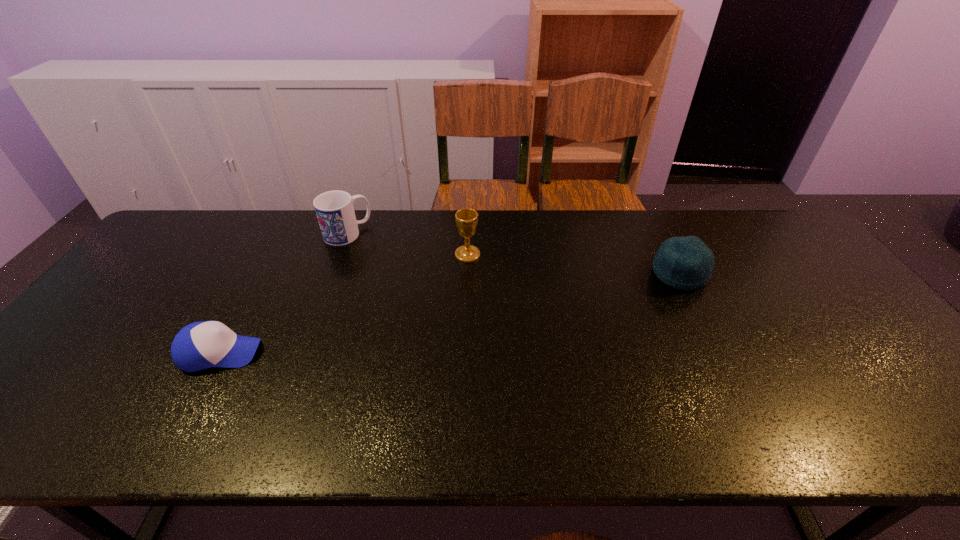
Locate an element on the screen. The height and width of the screenshot is (540, 960). free space between the farthest object and the nearest object is located at coordinates (284, 293).

The width and height of the screenshot is (960, 540). I want to click on vacant area that lies between the chalice and the shortest object, so click(x=344, y=304).

This screenshot has height=540, width=960. In order to click on empty space between the mug and the baseball cap in this screenshot , I will do `click(284, 293)`.

At what (x,y) coordinates should I click in order to perform the action: click on vacant space that's between the rightmost object and the shortest object. Please return your answer as a coordinate pair (x, y). Image resolution: width=960 pixels, height=540 pixels. Looking at the image, I should click on (450, 313).

You are a GUI agent. You are given a task and a screenshot of the screen. Output one action in this format:
    pyautogui.click(x=<x>, y=<y>)
    Task: Click on the vacant space in between the nearest object and the third object from right to left
    This screenshot has width=960, height=540.
    Given the screenshot: What is the action you would take?
    pyautogui.click(x=284, y=293)

You are a GUI agent. You are given a task and a screenshot of the screen. Output one action in this format:
    pyautogui.click(x=<x>, y=<y>)
    Task: Click on the vacant area that lies between the beanie and the shortest object
    
    Given the screenshot: What is the action you would take?
    pyautogui.click(x=450, y=313)

The height and width of the screenshot is (540, 960). Identify the location of free space between the chalice and the baseball cap. (344, 304).

Choose which object is the third nearest neighbor to the nearest object. Please provide its 2D coordinates. Your answer should be formatted as a tuple, i.e. [(x, y)], where the tuple contains the x and y coordinates of a point satisfying the conditions above.

[(686, 263)]

Identify the location of object that is the third closest to the farthest object. This screenshot has height=540, width=960. (686, 263).

I want to click on vacant area in the image that satisfies the following two spatial constraints: 1. on the front side of the beanie; 2. on the front-facing side of the leftmost object, so click(x=720, y=353).